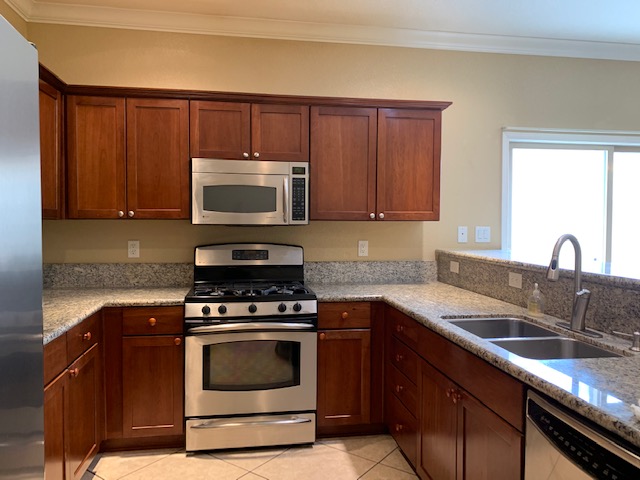
In order to click on oven door in this screenshot , I will do `click(250, 361)`.